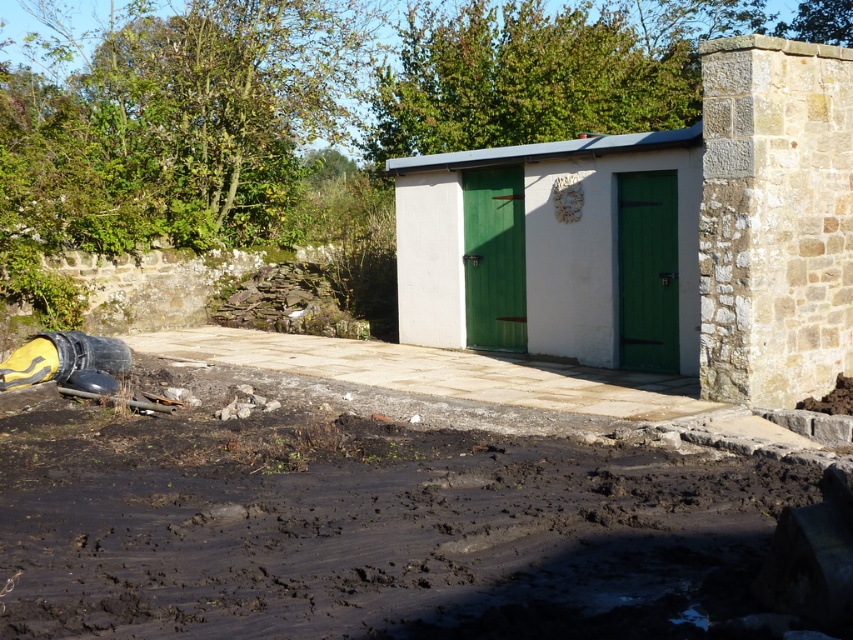
How distant is damp brown dirt at lower center from white wood shed at center?

The distance of damp brown dirt at lower center from white wood shed at center is 7.26 meters.

Can you confirm if damp brown dirt at lower center is wider than white wood shed at center?

In fact, damp brown dirt at lower center might be narrower than white wood shed at center.

Between point (556, 481) and point (590, 310), which one is positioned in front?

Point (556, 481)

Identify the location of damp brown dirt at lower center. This screenshot has width=853, height=640. 375,525.

Can you confirm if white painted wood shed at center is shorter than white wood shed at center?

Yes, white painted wood shed at center is shorter than white wood shed at center.

Does white painted wood shed at center have a lesser width compared to white wood shed at center?

Yes.

Between point (749, 221) and point (601, 292), which one is positioned in front?

Positioned in front is point (749, 221).

Image resolution: width=853 pixels, height=640 pixels. Find the location of `white painted wood shed at center`. white painted wood shed at center is located at coordinates 654,236.

What do you see at coordinates (375, 525) in the screenshot?
I see `damp brown dirt at lower center` at bounding box center [375, 525].

Can you confirm if damp brown dirt at lower center is positioned to the right of white painted wood shed at center?

In fact, damp brown dirt at lower center is to the left of white painted wood shed at center.

Where is `damp brown dirt at lower center`? The image size is (853, 640). damp brown dirt at lower center is located at coordinates (375, 525).

This screenshot has width=853, height=640. I want to click on damp brown dirt at lower center, so click(x=375, y=525).